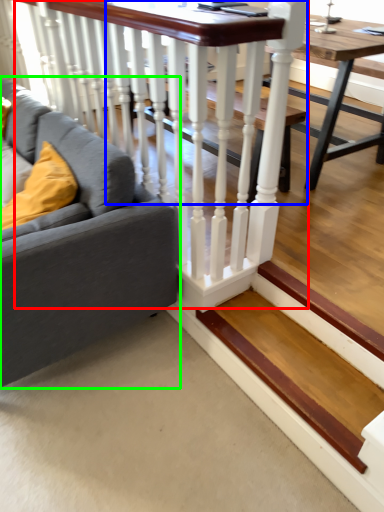
Question: Which object is positioned closest to rail (highlighted by a red box)? Select from table (highlighted by a blue box) and studio couch (highlighted by a green box).

Choices:
 (A) table
 (B) studio couch

Answer: (B)